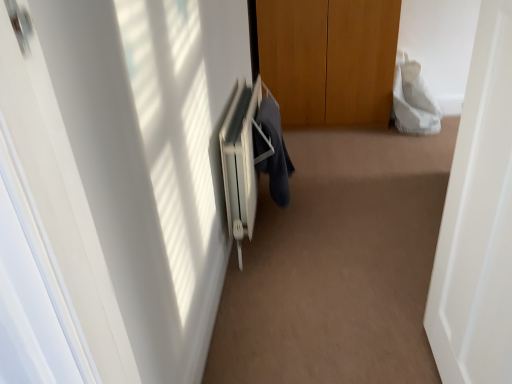
Question: Based on their positions, is white textured towel at upper right, the second robe ordered from the bottom, located to the left or right of dark blue fabric at center, which is the 1th robe in front-to-back order?

Choices:
 (A) left
 (B) right

Answer: (B)

Question: Looking at the image, does white textured towel at upper right, the second robe ordered from the bottom, seem bigger or smaller compared to dark blue fabric at center, the 2th robe in the back-to-front sequence?

Choices:
 (A) small
 (B) big

Answer: (B)

Question: Based on their relative distances, which object is nearer to the dark blue fabric at center, the 2th robe in the back-to-front sequence?

Choices:
 (A) white textured towel at upper right, the second robe ordered from the bottom
 (B) white matte door at right
 (C) white plastic radiator at center

Answer: (C)

Question: Which is nearer to the white plastic radiator at center?

Choices:
 (A) white textured towel at upper right, the second robe ordered from the bottom
 (B) white matte door at right
 (C) dark blue fabric at center, the 2th robe in the back-to-front sequence

Answer: (C)